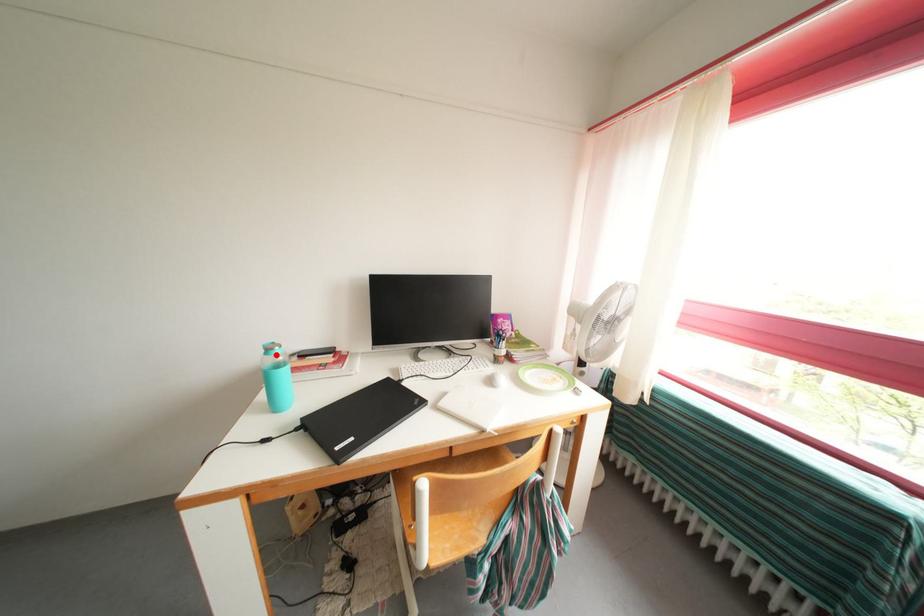
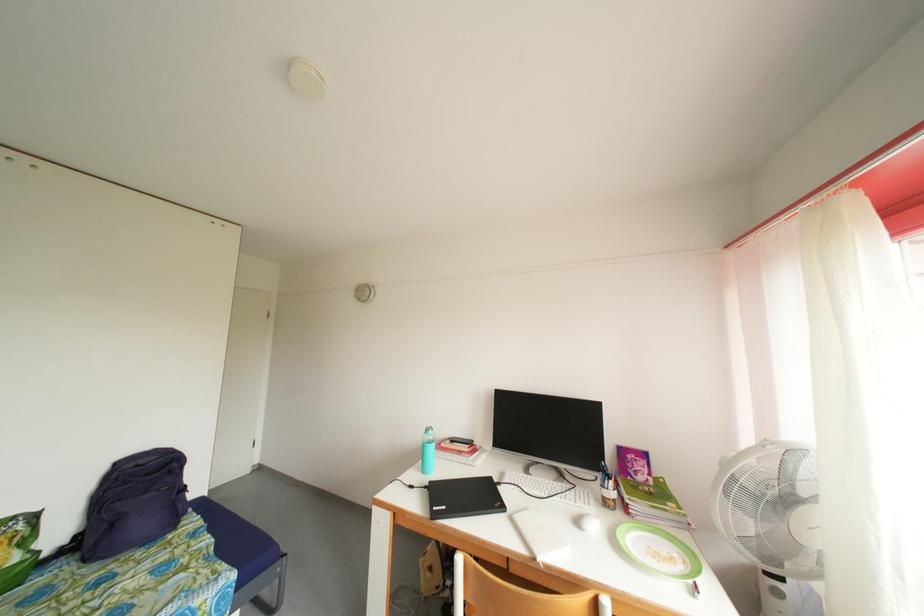
Find the pixel in the second image that matches the highlighted location in the first image.

(434, 436)